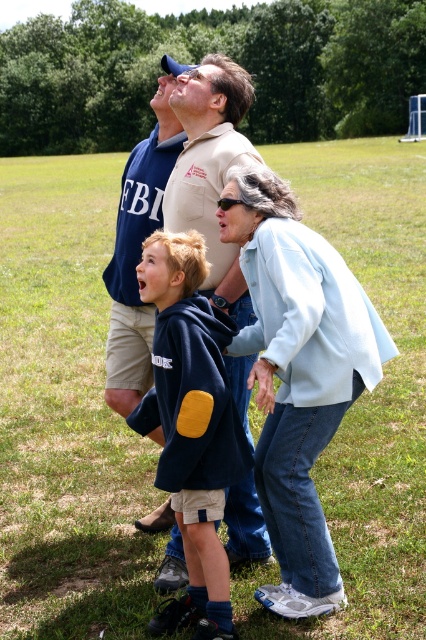
Question: Observing the image, what is the correct spatial positioning of light blue denim jacket at center in reference to dark blue fleece at center?

Choices:
 (A) below
 (B) above

Answer: (B)

Question: Is light blue denim jacket at center positioned in front of dark blue fleece at center?

Choices:
 (A) no
 (B) yes

Answer: (B)

Question: Is light blue denim jacket at center to the right of dark blue fleece at center from the viewer's perspective?

Choices:
 (A) no
 (B) yes

Answer: (B)

Question: Which is nearer to the matte khaki shirt at center?

Choices:
 (A) matte blue shirt at center
 (B) light blue denim jacket at center
 (C) dark blue fleece at center

Answer: (C)

Question: Which object is farther from the camera taking this photo?

Choices:
 (A) matte khaki shirt at center
 (B) light blue denim jacket at center

Answer: (A)

Question: Which of the following is the closest to the observer?

Choices:
 (A) matte khaki shirt at center
 (B) matte blue shirt at center
 (C) dark blue fleece at center

Answer: (C)